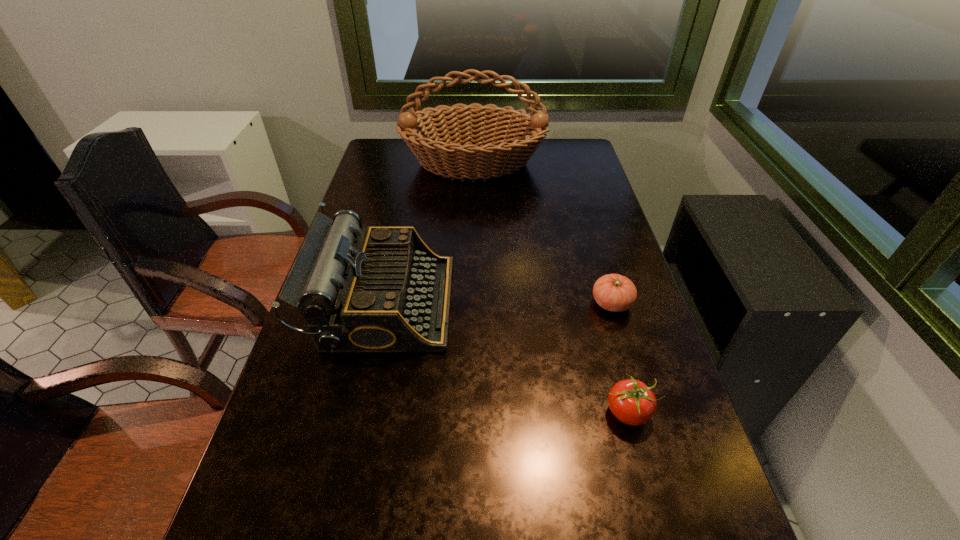
Identify the location of basket that is at the left edge. (430, 135).

Find the location of a particular element. typewriter that is at the left edge is located at coordinates (386, 291).

Identify the location of object positioned at the far left corner. (430, 135).

This screenshot has width=960, height=540. Identify the location of free space at the left edge of the desktop. (350, 386).

Locate an element on the screen. The height and width of the screenshot is (540, 960). free space at the right edge is located at coordinates (698, 470).

At what (x,y) coordinates should I click in order to perform the action: click on vacant area at the far left corner of the desktop. Please return your answer as a coordinate pair (x, y). Image resolution: width=960 pixels, height=540 pixels. Looking at the image, I should click on (390, 149).

In the image, there is a desktop. Where is `vacant space at the far right corner`? This screenshot has width=960, height=540. vacant space at the far right corner is located at coordinates (587, 161).

This screenshot has height=540, width=960. I want to click on vacant space that is in between the nearer tomato and the third shortest object, so click(506, 357).

Image resolution: width=960 pixels, height=540 pixels. In order to click on free space between the farther tomato and the nearest object in this screenshot , I will do `click(619, 358)`.

This screenshot has height=540, width=960. Identify the location of vacant area that lies between the nearer tomato and the basket. (550, 288).